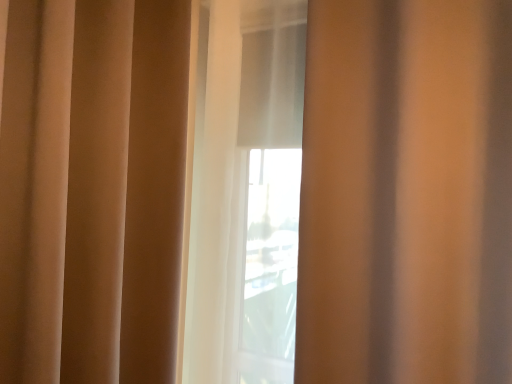
Image resolution: width=512 pixels, height=384 pixels. Describe the element at coordinates (406, 193) in the screenshot. I see `matte beige curtain at center` at that location.

In order to click on matte beige curtain at center in this screenshot , I will do `click(406, 193)`.

Find the location of a particular element. matte beige curtain at center is located at coordinates (406, 193).